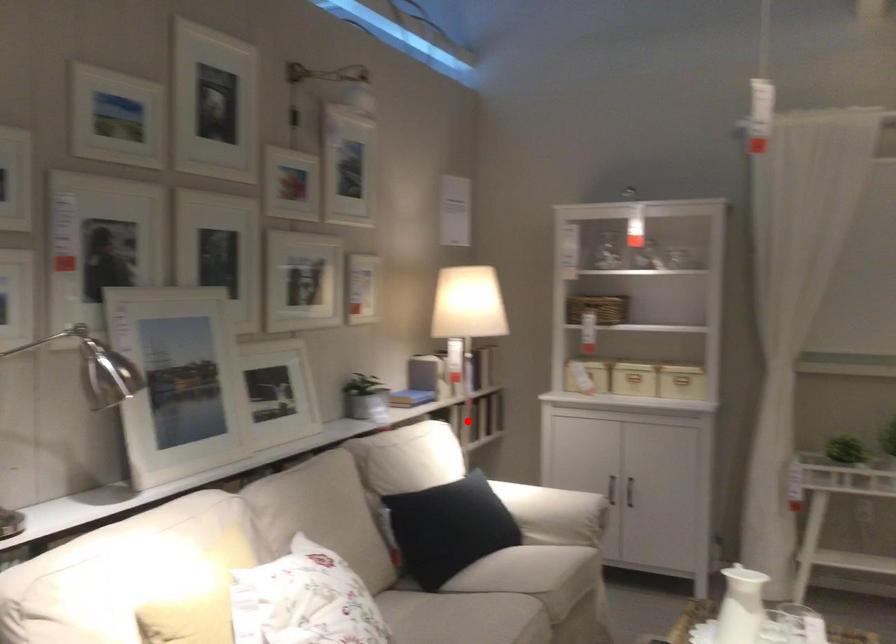
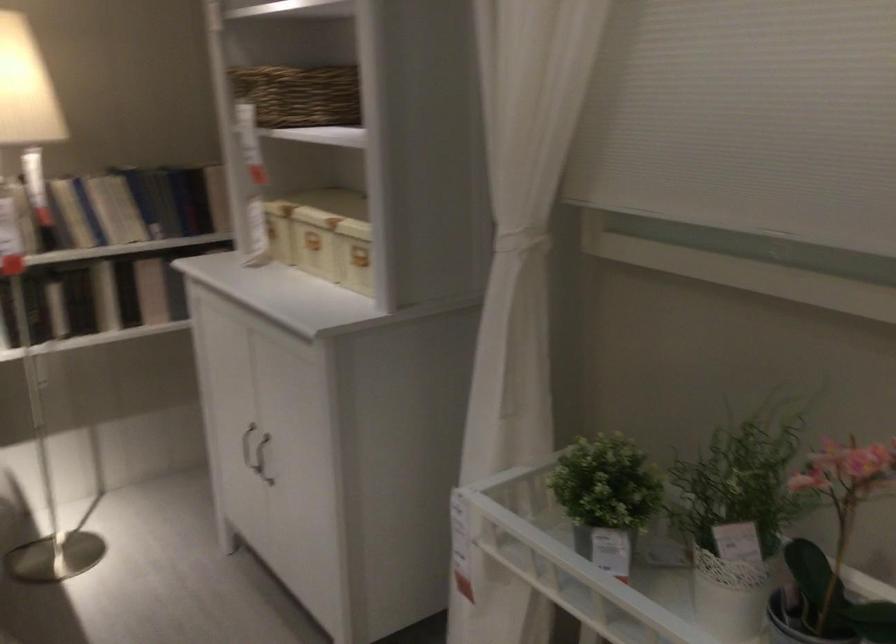
Question: A red point is marked in image1. In image2, is the corresponding 3D point closer to the camera or farther? Reply with the corresponding letter.

Choices:
 (A) The corresponding 3D point is closer.
 (B) The corresponding 3D point is farther.

Answer: (A)